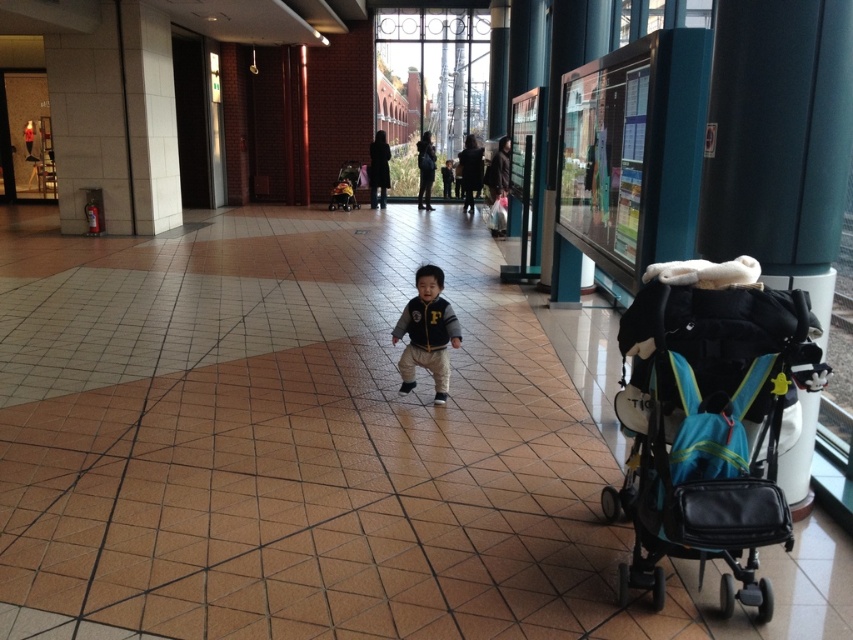
Is teal fabric stroller at right to the left of matte black jacket at center from the viewer's perspective?

Incorrect, teal fabric stroller at right is not on the left side of matte black jacket at center.

Who is more forward, (744,264) or (437,291)?

Positioned in front is point (744,264).

This screenshot has width=853, height=640. Find the location of `teal fabric stroller at right`. teal fabric stroller at right is located at coordinates (708, 420).